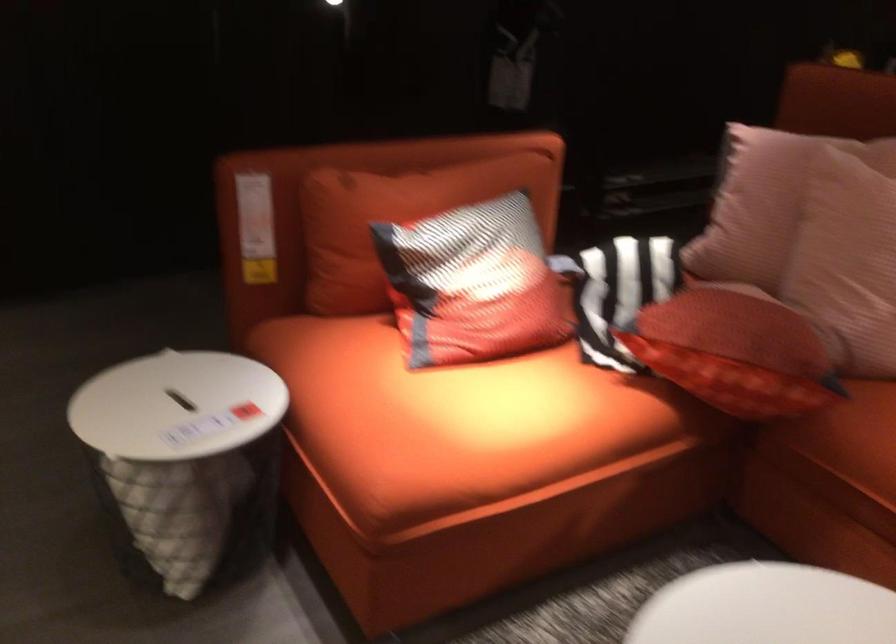
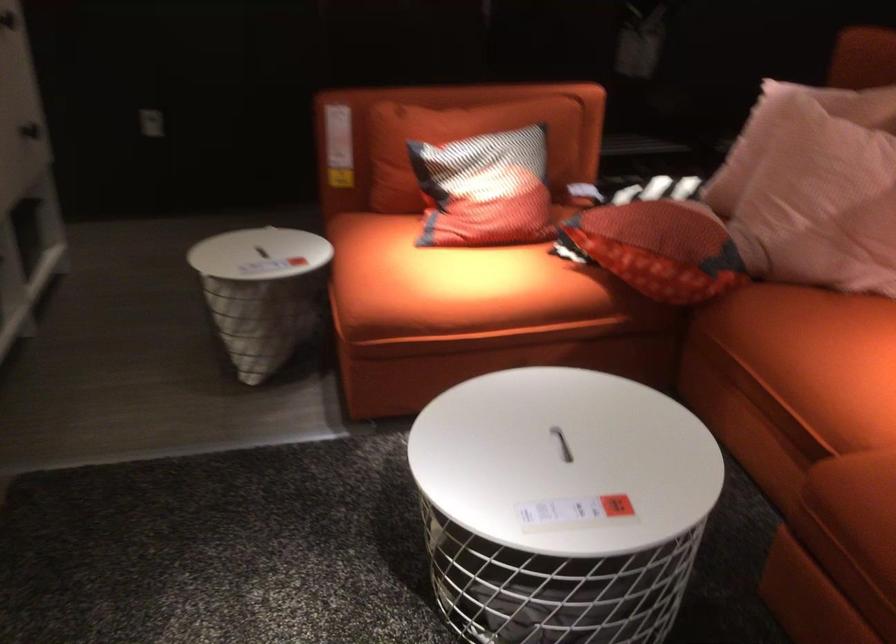
Locate, in the second image, the point that corresponds to [478,424] in the first image.

(449, 281)